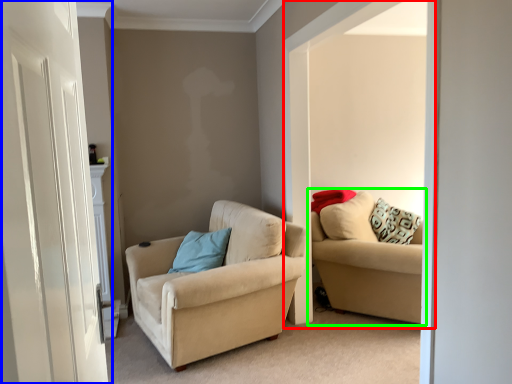
Question: Which object is the closest to the window (highlighted by a red box)? Choose among these: door (highlighted by a blue box) or studio couch (highlighted by a green box).

Choices:
 (A) door
 (B) studio couch

Answer: (B)